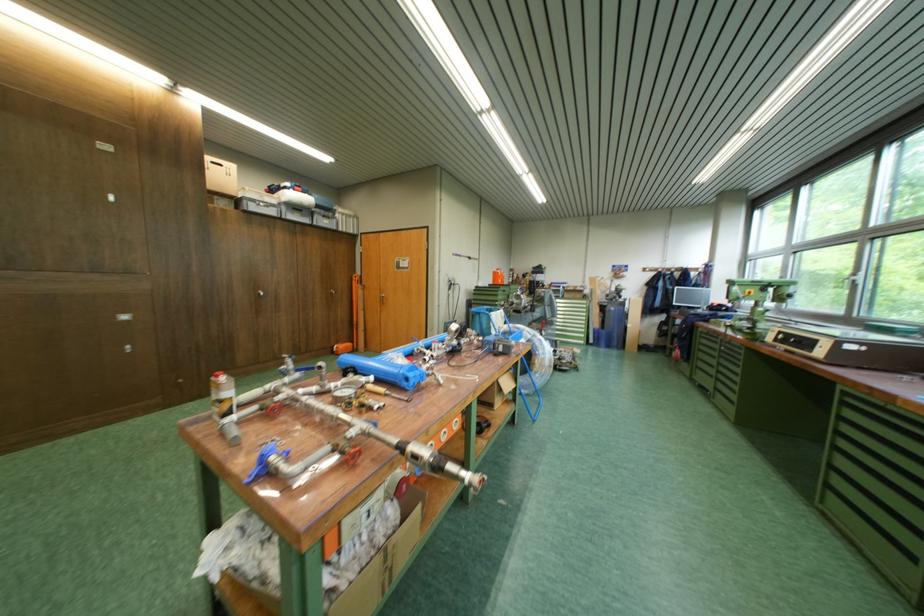
Image resolution: width=924 pixels, height=616 pixels. Identify the location of silver door handle. (374, 294).